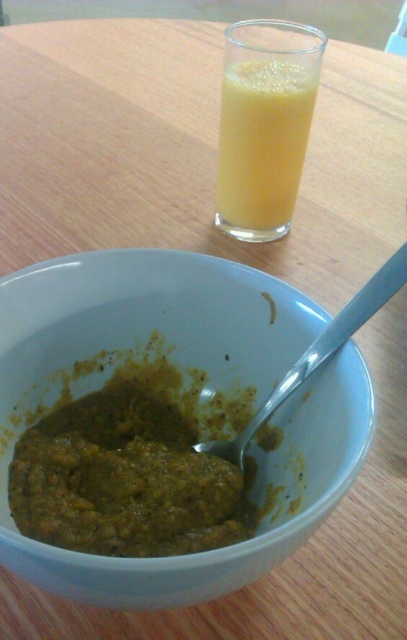
Question: Based on their relative distances, which object is nearer to the yellow translucent glass at upper center?

Choices:
 (A) silver metallic spoon at bowl center
 (B) matte ceramic bowl at center

Answer: (A)

Question: Which object is the closest to the matte ceramic bowl at center?

Choices:
 (A) yellow translucent glass at upper center
 (B) silver metallic spoon at bowl center

Answer: (B)

Question: Which of the following is the farthest from the observer?

Choices:
 (A) yellow translucent glass at upper center
 (B) matte ceramic bowl at center

Answer: (A)

Question: Can you confirm if yellow translucent glass at upper center is bigger than silver metallic spoon at bowl center?

Choices:
 (A) yes
 (B) no

Answer: (B)

Question: Is yellow translucent glass at upper center bigger than silver metallic spoon at bowl center?

Choices:
 (A) yes
 (B) no

Answer: (B)

Question: Does matte ceramic bowl at center lie in front of silver metallic spoon at bowl center?

Choices:
 (A) yes
 (B) no

Answer: (A)